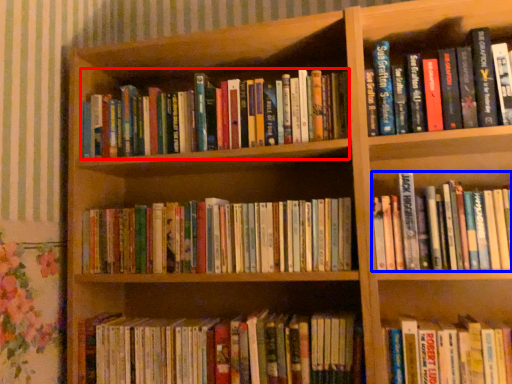
Question: Among these objects, which one is nearest to the camera, book (highlighted by a red box) or book (highlighted by a blue box)?

Choices:
 (A) book
 (B) book

Answer: (B)